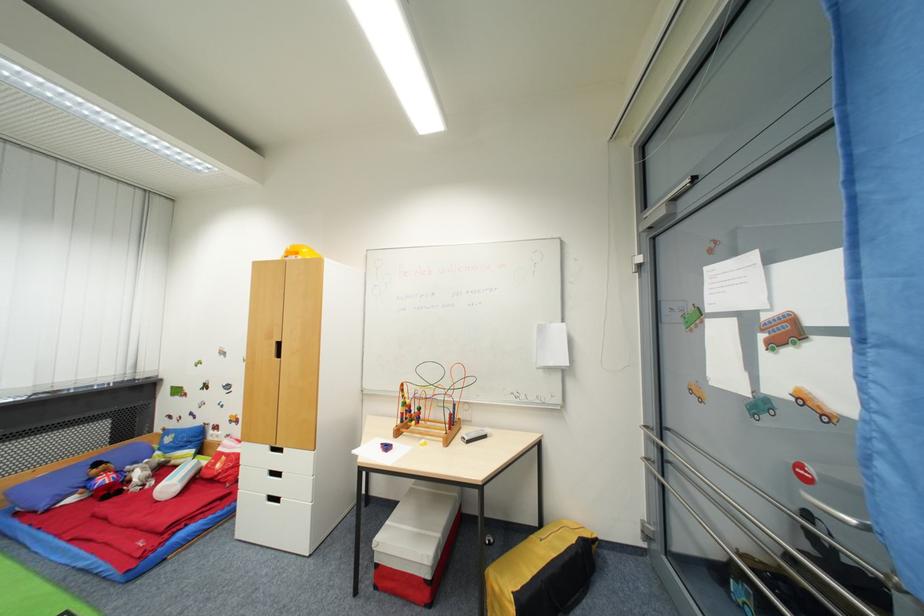
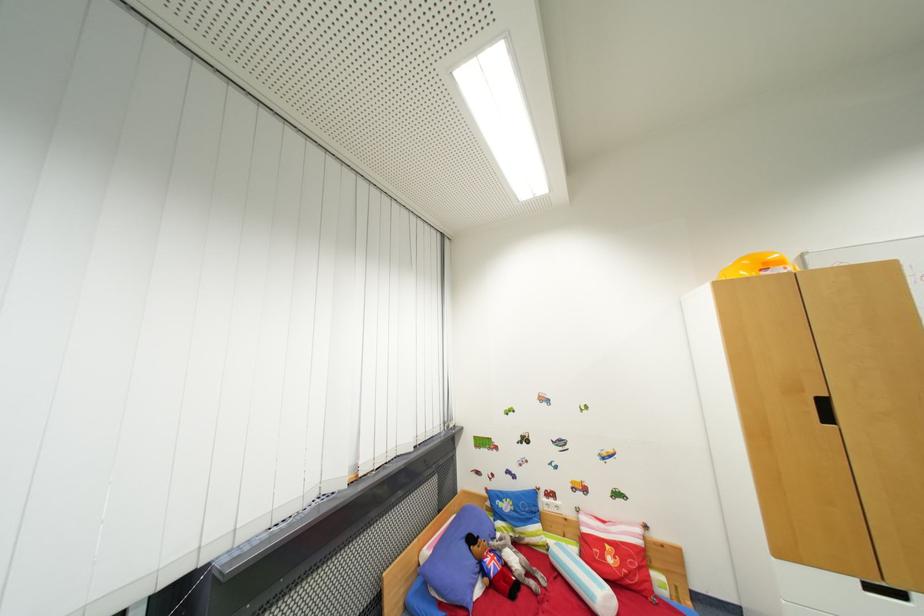
Find the pixel in the second image that matches the point at 176,487 in the first image.

(605, 596)